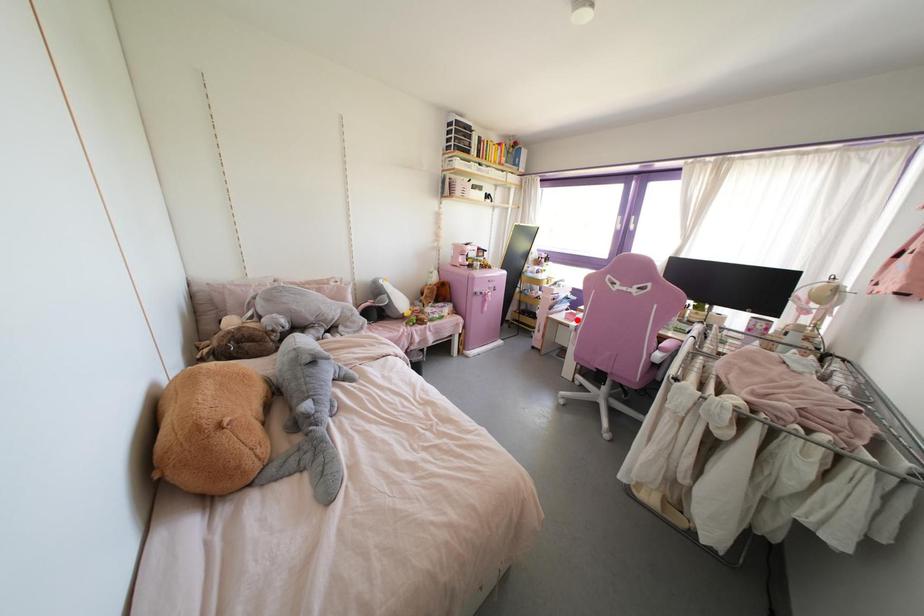
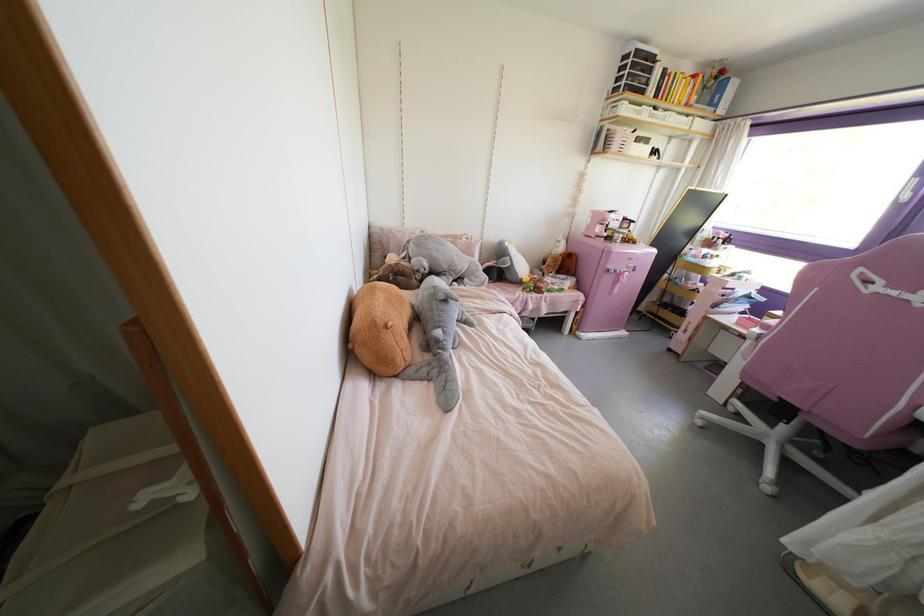
In the second image, find the point that corresponds to the highlighted location in the first image.

(764, 326)